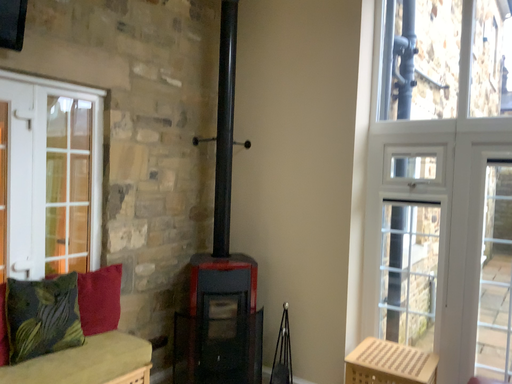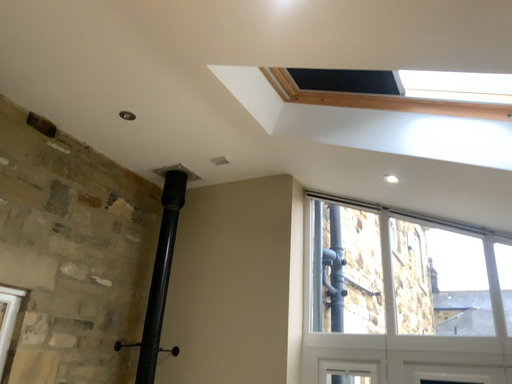
Question: Which way did the camera rotate in the video?

Choices:
 (A) rotated right
 (B) rotated left

Answer: (A)